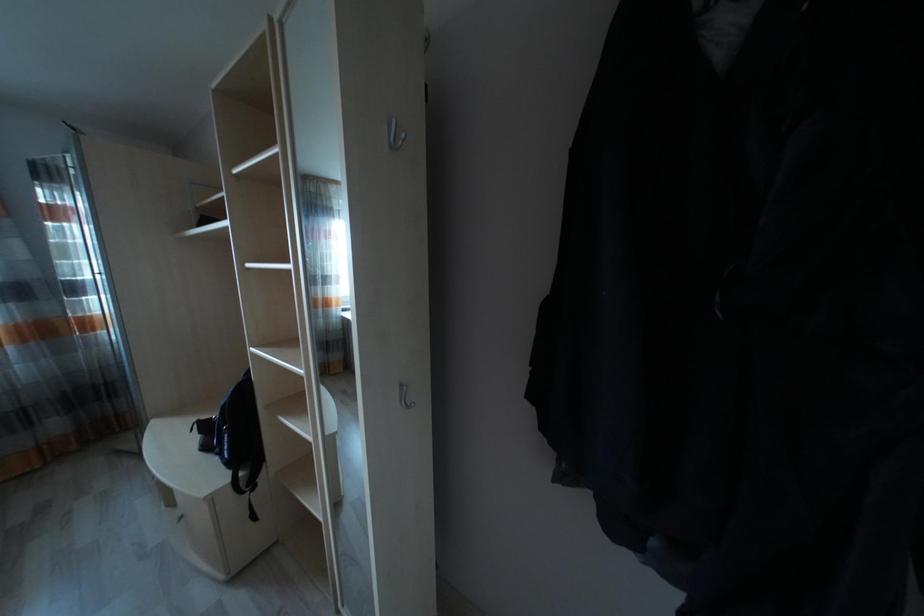
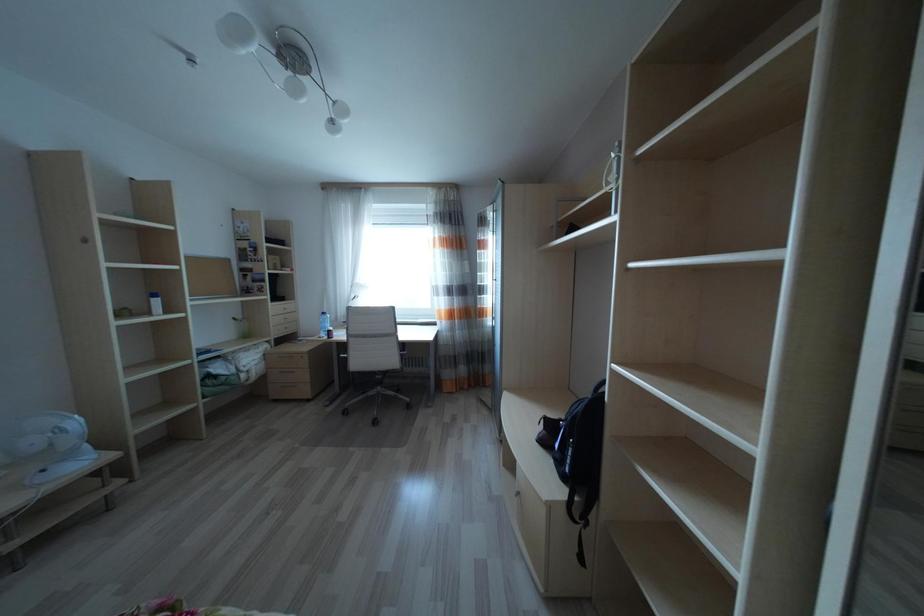
Question: The camera is either moving clockwise (left) or counter-clockwise (right) around the object. The first image is from the beginning of the video and the second image is from the end. Is the camera moving left or right when shooting the video?

Choices:
 (A) Left
 (B) Right

Answer: (B)